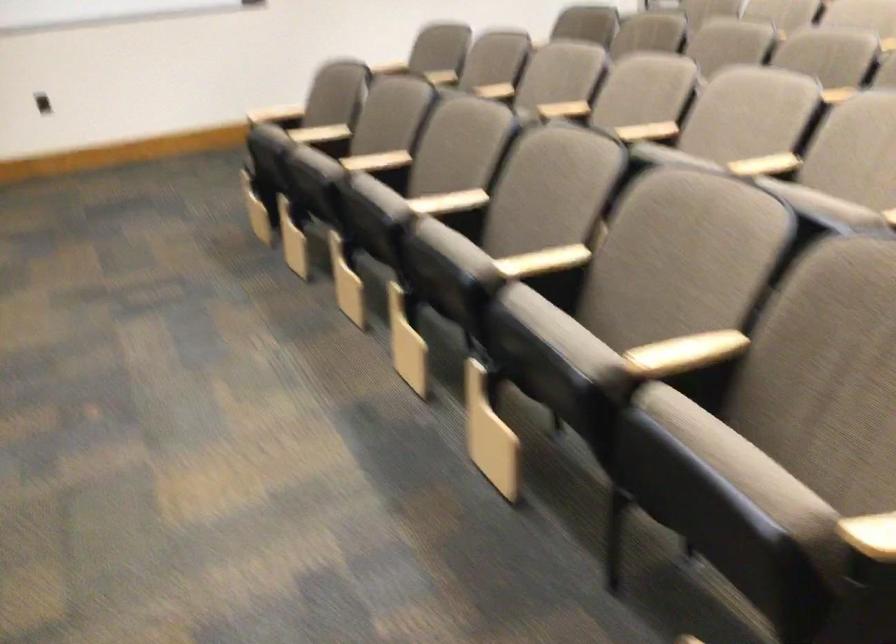
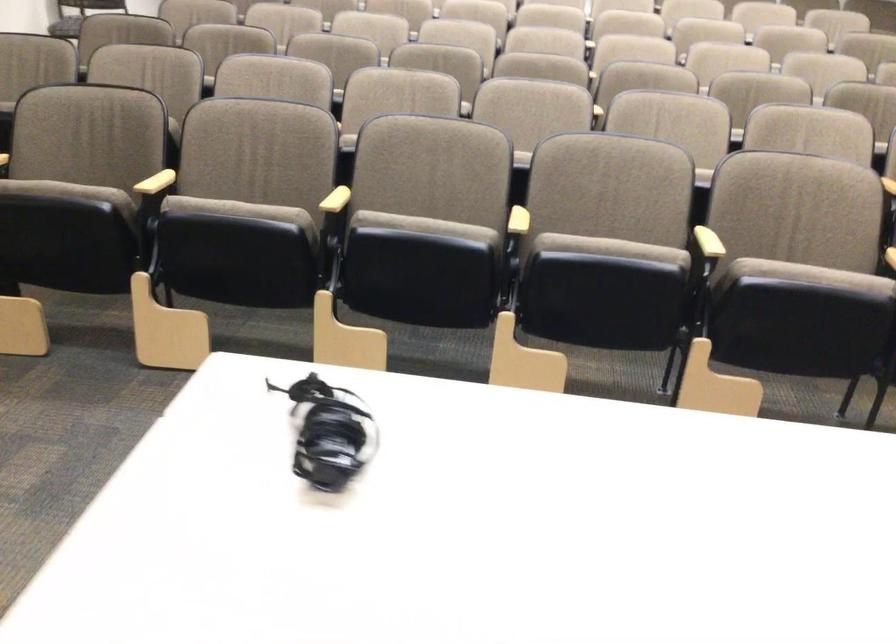
In the second image, find the point that corresponds to [277,131] in the first image.

(156, 182)